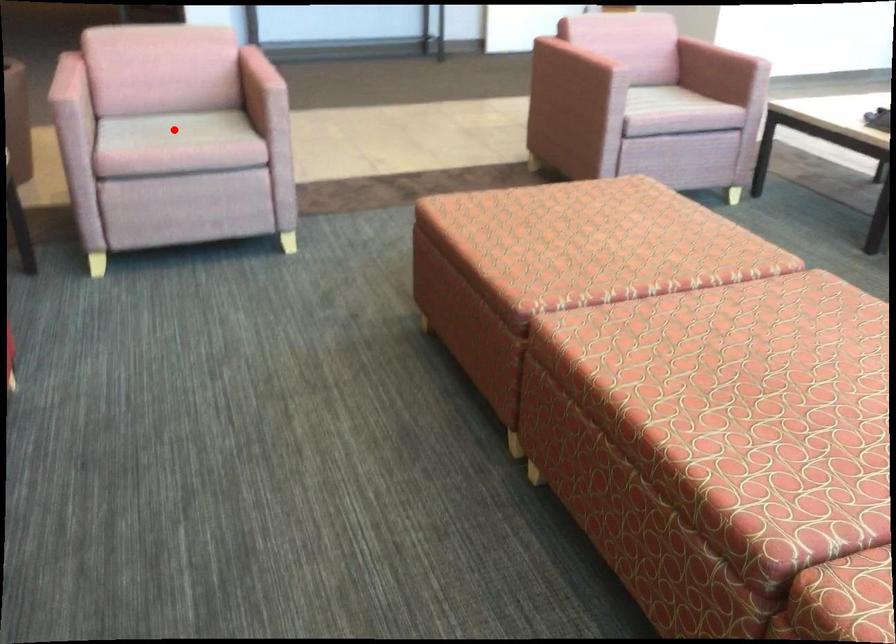
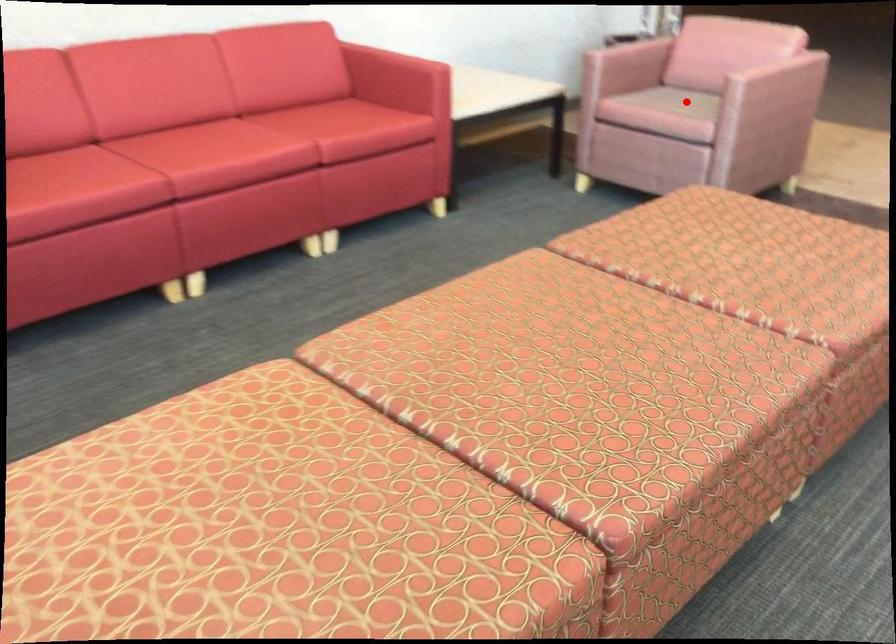
I am providing you with two images of the same scene from different viewpoints. A red point is marked on the first image and another point is marked on the second image. Is the marked point in image1 the same physical position as the marked point in image2?

Yes